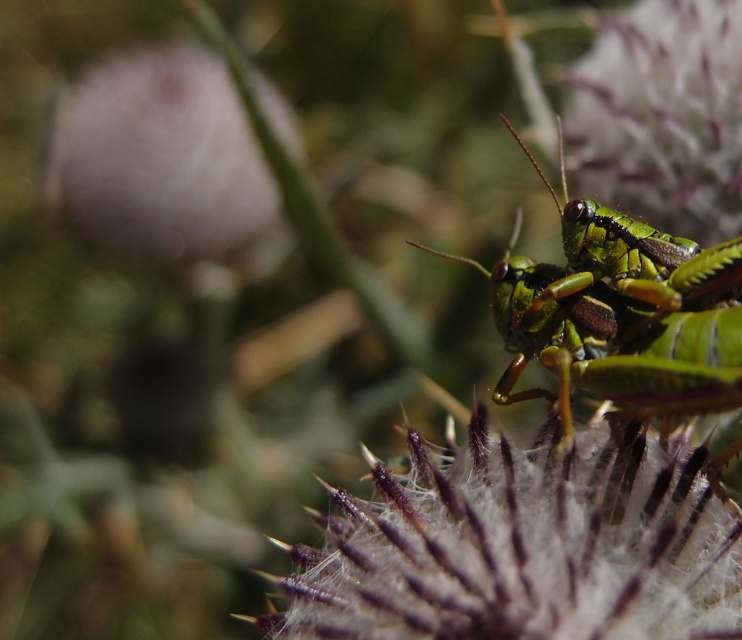
You are a gardener observing the plant with spiky, fuzzy, purple tipped stems. You notice the fuzzy white flower at center and the green metallic grasshopper at center. Which object is located below the other?

The fuzzy white flower at center is positioned under the green metallic grasshopper at center.

You are a small insect with a body length of 1 inch. You want to move from the fuzzy white flower at center to the green metallic grasshopper at center. Can you fit through the space between them?

The distance between the fuzzy white flower at center and the green metallic grasshopper at center is 7.92 inches, which is more than enough space for a 1 inch long insect to move through comfortably.

Consider the image. You are a photographer aiming to capture a closeup of the fuzzy white flower at center and the green matte grasshopper at upper right. Based on their positions, which one would you need to focus on first if you move the camera upward?

The green matte grasshopper at upper right is higher than the fuzzy white flower at center, so you should focus on the green matte grasshopper at upper right first as you move the camera upward.